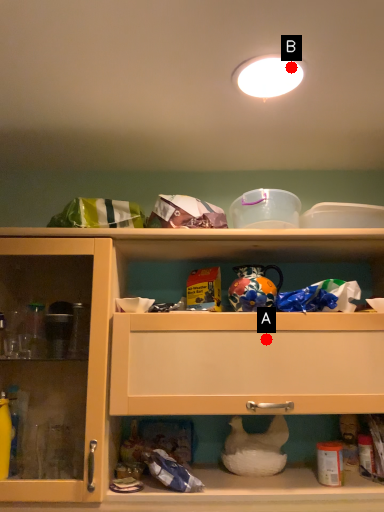
Question: Two points are circled on the image, labeled by A and B beside each circle. Which point is closer to the camera?

Choices:
 (A) A is closer
 (B) B is closer

Answer: (B)